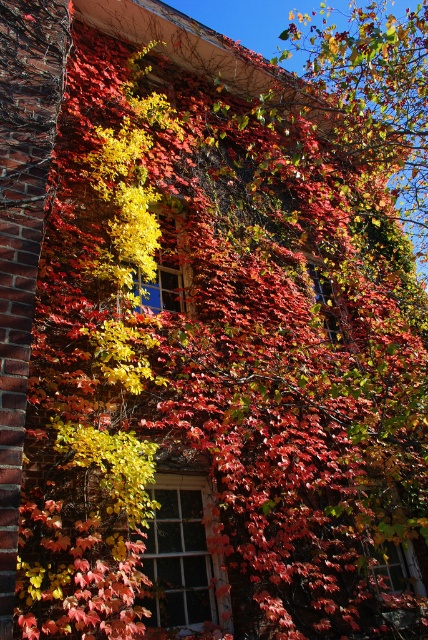
Between white wooden window at center and transparent glass window at center, which one is positioned lower?

white wooden window at center is below.

Can you confirm if white wooden window at center is thinner than transparent glass window at center?

No.

Between point (175, 620) and point (329, 296), which one is positioned in front?

Point (175, 620)

At what (x,y) coordinates should I click in order to perform the action: click on white wooden window at center. Please return your answer as a coordinate pair (x, y). Looking at the image, I should click on (183, 556).

Is point (157, 275) positioned after point (318, 268)?

No, (157, 275) is in front of (318, 268).

Between point (154, 282) and point (335, 291), which one is positioned in front?

Point (154, 282) is in front.

Find the location of a particular element. The width and height of the screenshot is (428, 640). blue glass window at center is located at coordinates (162, 273).

Image resolution: width=428 pixels, height=640 pixels. Describe the element at coordinates (183, 556) in the screenshot. I see `white wooden window at center` at that location.

Can you confirm if white wooden window at center is positioned to the left of blue glass window at center?

Incorrect, white wooden window at center is not on the left side of blue glass window at center.

Is point (165, 586) more distant than point (183, 282)?

No.

What are the coordinates of `white wooden window at center` in the screenshot? It's located at (183, 556).